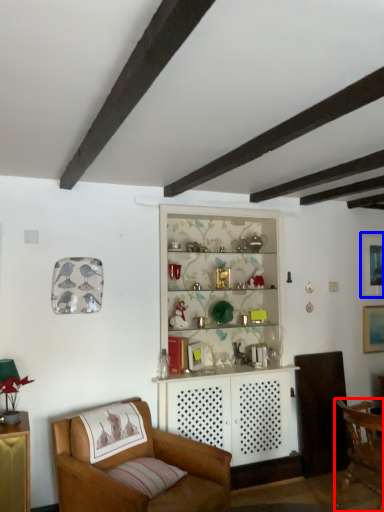
Question: Which object appears farthest to the camera in this image, chair (highlighted by a red box) or picture frame (highlighted by a blue box)?

Choices:
 (A) chair
 (B) picture frame

Answer: (B)